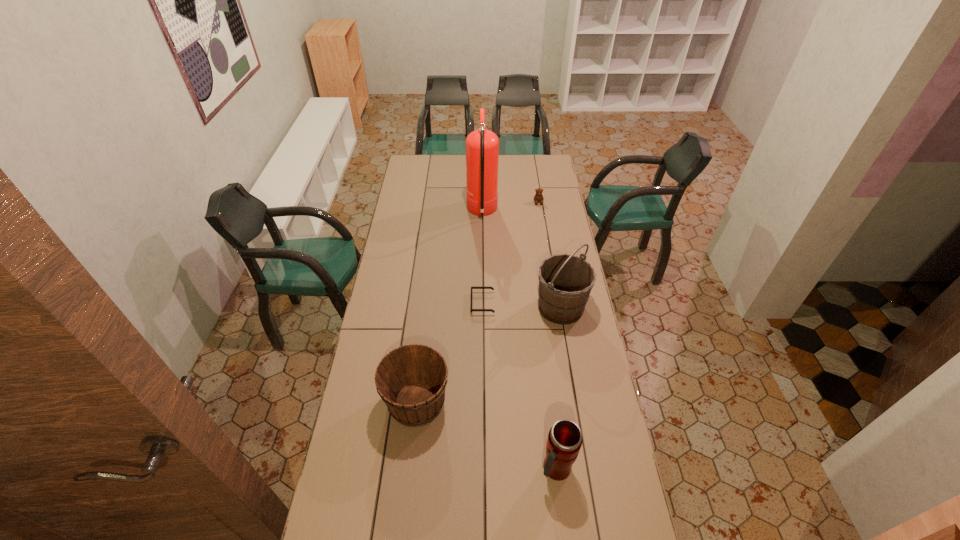
Identify the location of blank space located towards the nozzle of the fire extinguisher. (455, 212).

Identify the location of free spot located 0.400m on the left of the second tallest object. The width and height of the screenshot is (960, 540). (442, 307).

Find the location of a particular element. Image resolution: width=960 pixels, height=540 pixels. vacant space positioned on the side with the handle of the thermos bottle is located at coordinates (564, 537).

Where is `vacant space situated on the back of the leftmost object`? vacant space situated on the back of the leftmost object is located at coordinates (426, 319).

At what (x,y) coordinates should I click in order to perform the action: click on free space located 0.140m on the face of the second shortest object. Please return your answer as a coordinate pair (x, y). This screenshot has height=540, width=960. Looking at the image, I should click on (541, 221).

Where is `vacant space located on the front-facing side of the sunglasses`? This screenshot has height=540, width=960. vacant space located on the front-facing side of the sunglasses is located at coordinates (386, 303).

Locate an element on the screen. Image resolution: width=960 pixels, height=540 pixels. free space located 0.350m on the front-facing side of the sunglasses is located at coordinates (391, 303).

The image size is (960, 540). I want to click on vacant space located on the front-facing side of the sunglasses, so click(x=384, y=303).

This screenshot has width=960, height=540. Identify the location of object that is at the left edge. (411, 380).

The width and height of the screenshot is (960, 540). In order to click on bucket situated at the right edge in this screenshot , I will do `click(565, 281)`.